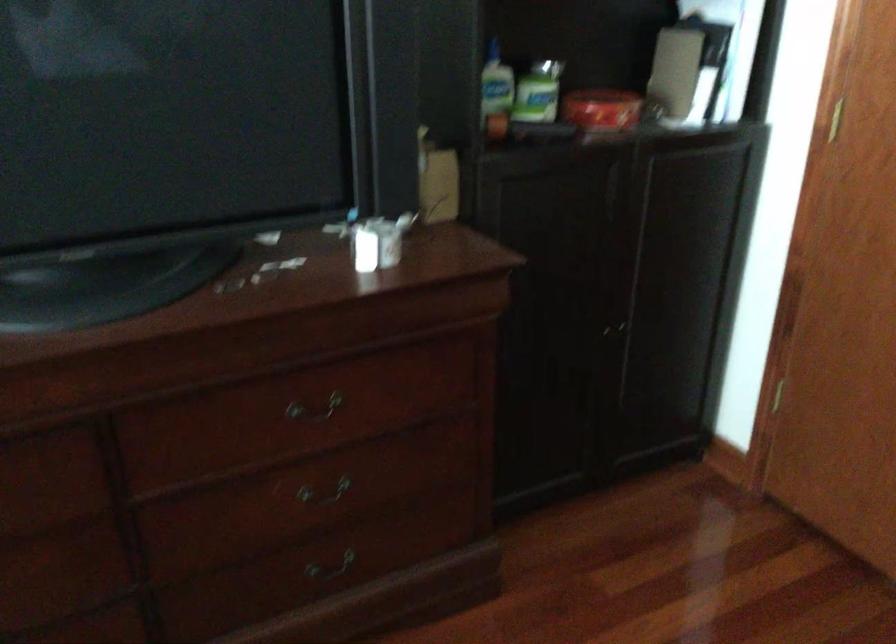
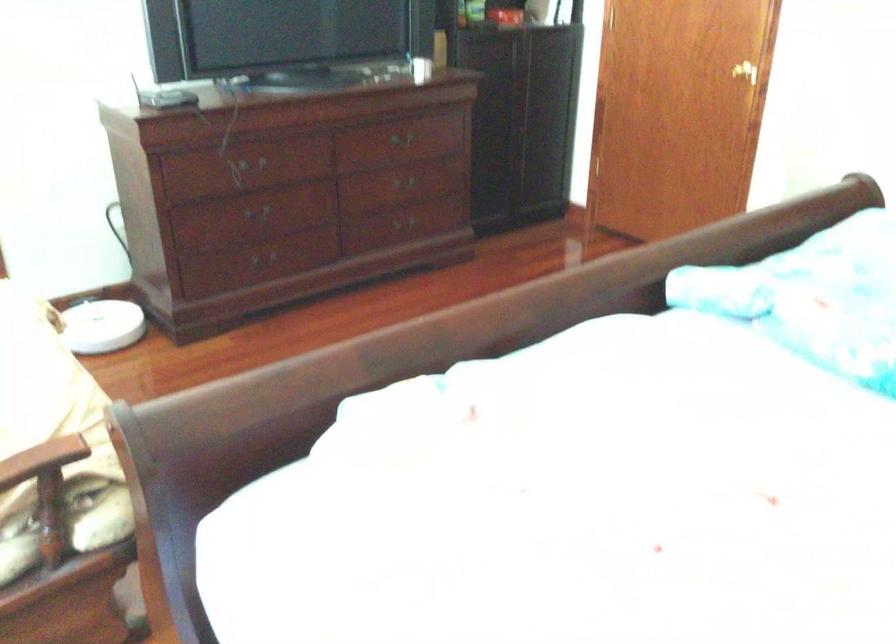
Question: In a continuous first-person perspective shot, in which direction is the camera moving?

Choices:
 (A) Left
 (B) Right
 (C) Forward
 (D) Backward

Answer: (D)